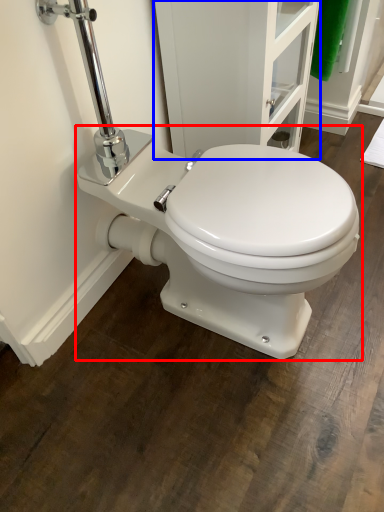
Question: Which object is further to the camera taking this photo, toilet (highlighted by a red box) or screen door (highlighted by a blue box)?

Choices:
 (A) toilet
 (B) screen door

Answer: (B)